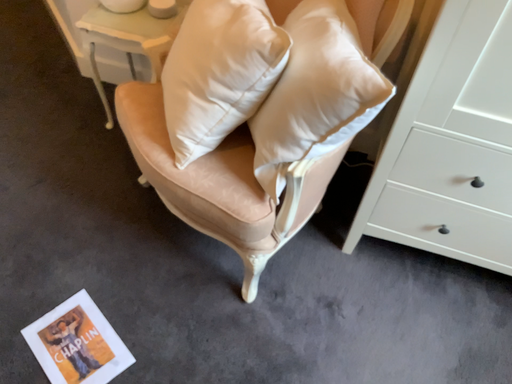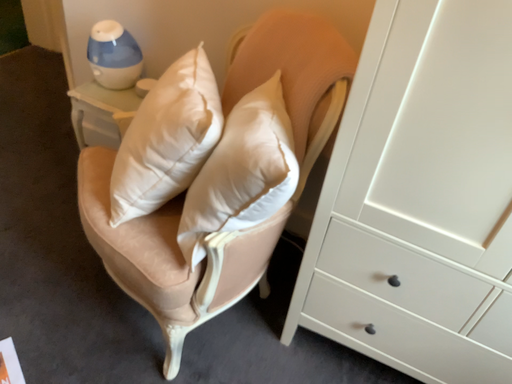
Question: How did the camera likely rotate when shooting the video?

Choices:
 (A) rotated downward
 (B) rotated upward

Answer: (B)